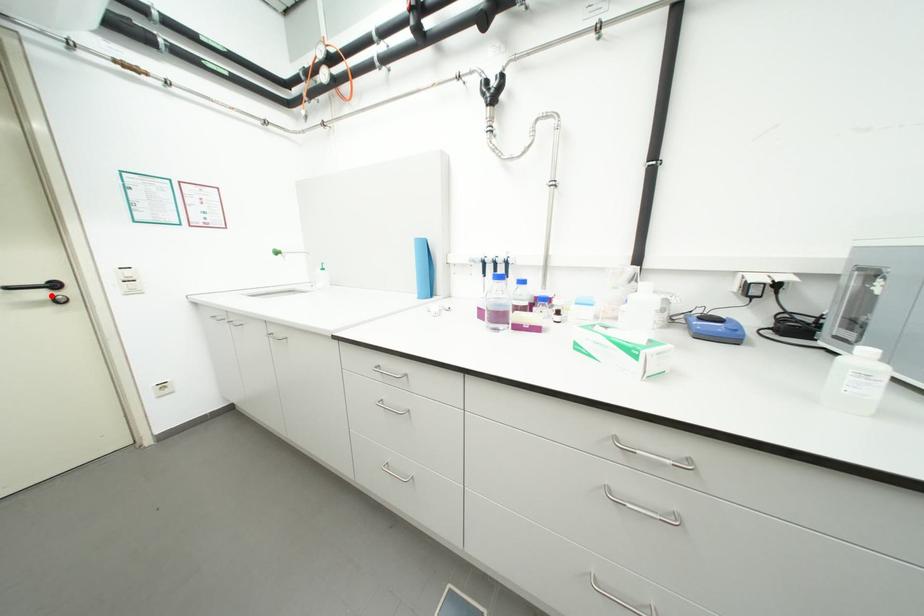
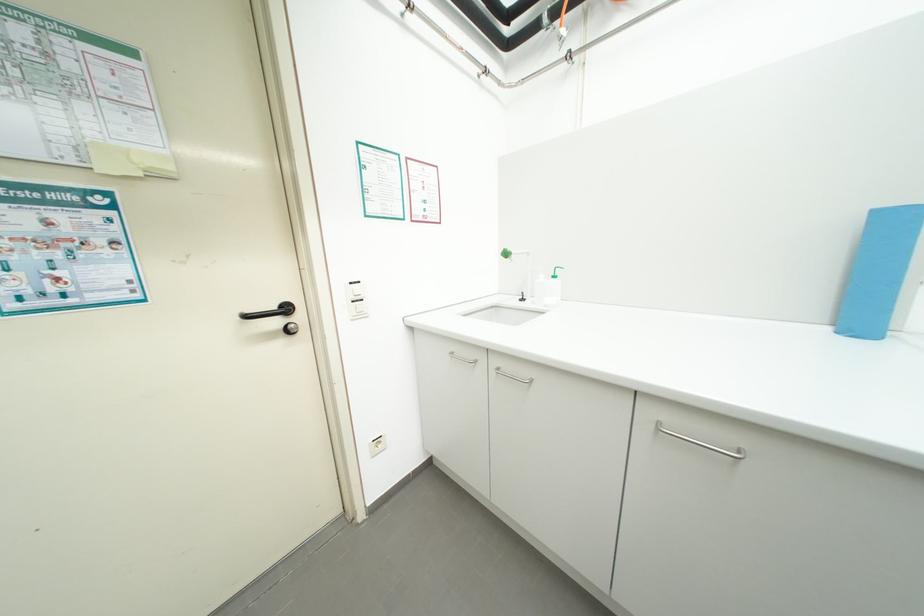
The point at the highlighted location is marked in the first image. Where is the corresponding point in the second image?

(285, 323)